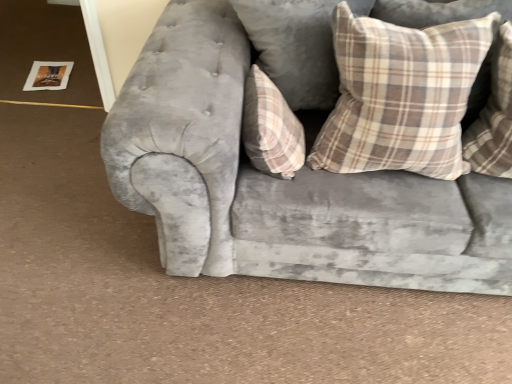
Describe the element at coordinates (271, 128) in the screenshot. The height and width of the screenshot is (384, 512). I see `plaid fabric pillow at center, the third pillow viewed from the right` at that location.

Where is `plaid fabric pillow at upper right, which ranks as the second pillow in right-to-left order`? The image size is (512, 384). plaid fabric pillow at upper right, which ranks as the second pillow in right-to-left order is located at coordinates (401, 95).

Identify the location of pillow above the plaid fabric pillow at upper right, which ranks as the second pillow in right-to-left order (from a real-world perspective). click(x=494, y=116).

From the picture: Is plaid fabric pillow at upper right, which ranks as the 1th pillow in right-to-left order, next to plaid fabric pillow at upper right, which ranks as the second pillow in right-to-left order, and touching it?

No, plaid fabric pillow at upper right, which ranks as the 1th pillow in right-to-left order, is not next to plaid fabric pillow at upper right, which ranks as the second pillow in right-to-left order.

From a real-world perspective, which is physically above, plaid fabric pillow at upper right, which ranks as the 1th pillow in right-to-left order, or plaid fabric pillow at upper right, the second pillow when ordered from left to right?

plaid fabric pillow at upper right, which ranks as the 1th pillow in right-to-left order, is physically above.

Does plaid fabric pillow at upper right, which ranks as the 1th pillow in right-to-left order, have a greater width compared to plaid fabric pillow at upper right, the second pillow when ordered from left to right?

Indeed, plaid fabric pillow at upper right, which ranks as the 1th pillow in right-to-left order, has a greater width compared to plaid fabric pillow at upper right, the second pillow when ordered from left to right.

Is plaid fabric pillow at center, which is counted as the first pillow, starting from the left, to the right of plaid fabric pillow at upper right, the second pillow when ordered from left to right, from the viewer's perspective?

No, plaid fabric pillow at center, which is counted as the first pillow, starting from the left, is not to the right of plaid fabric pillow at upper right, the second pillow when ordered from left to right.

Is plaid fabric pillow at center, which is counted as the first pillow, starting from the left, facing towards plaid fabric pillow at upper right, the second pillow when ordered from left to right?

Yes, plaid fabric pillow at center, which is counted as the first pillow, starting from the left, is turned towards plaid fabric pillow at upper right, the second pillow when ordered from left to right.

Is plaid fabric pillow at center, the third pillow viewed from the right, positioned far away from plaid fabric pillow at upper right, which ranks as the second pillow in right-to-left order?

No, plaid fabric pillow at center, the third pillow viewed from the right, is not far from plaid fabric pillow at upper right, which ranks as the second pillow in right-to-left order.

From the image's perspective, is plaid fabric pillow at center, the third pillow viewed from the right, over plaid fabric pillow at upper right, the second pillow when ordered from left to right?

No, from the image's perspective, plaid fabric pillow at center, the third pillow viewed from the right, is not above plaid fabric pillow at upper right, the second pillow when ordered from left to right.

Where is `the 1st pillow above the plaid fabric pillow at center, the third pillow viewed from the right (from the image's perspective)`? the 1st pillow above the plaid fabric pillow at center, the third pillow viewed from the right (from the image's perspective) is located at coordinates (494, 116).

Is point (275, 155) positioned after point (470, 134)?

No, it is not.

Is plaid fabric pillow at upper right, which ranks as the 1th pillow in right-to-left order, completely or partially inside plaid fabric pillow at center, the third pillow viewed from the right?

No.

Is plaid fabric pillow at center, the third pillow viewed from the right, closer to camera compared to plaid fabric pillow at upper right, which ranks as the 1th pillow in right-to-left order?

No, plaid fabric pillow at center, the third pillow viewed from the right, is behind plaid fabric pillow at upper right, which ranks as the 1th pillow in right-to-left order.

Consider the image. Is plaid fabric pillow at upper right, which ranks as the second pillow in right-to-left order, next to plaid fabric pillow at upper right, which is the 3th pillow in left-to-right order, and touching it?

plaid fabric pillow at upper right, which ranks as the second pillow in right-to-left order, and plaid fabric pillow at upper right, which is the 3th pillow in left-to-right order, are not in contact.

From a real-world perspective, is plaid fabric pillow at upper right, which ranks as the second pillow in right-to-left order, above or below plaid fabric pillow at upper right, which is the 3th pillow in left-to-right order?

plaid fabric pillow at upper right, which ranks as the second pillow in right-to-left order, is below plaid fabric pillow at upper right, which is the 3th pillow in left-to-right order.

Which is further, (371, 35) or (463, 150)?

Point (463, 150)

Considering the sizes of objects plaid fabric pillow at upper right, the second pillow when ordered from left to right, and plaid fabric pillow at center, the third pillow viewed from the right, in the image provided, who is smaller, plaid fabric pillow at upper right, the second pillow when ordered from left to right, or plaid fabric pillow at center, the third pillow viewed from the right,?

plaid fabric pillow at center, the third pillow viewed from the right.

Is plaid fabric pillow at upper right, the second pillow when ordered from left to right, positioned before plaid fabric pillow at center, the third pillow viewed from the right?

Yes, plaid fabric pillow at upper right, the second pillow when ordered from left to right, is closer to the viewer.

Between plaid fabric pillow at upper right, the second pillow when ordered from left to right, and plaid fabric pillow at center, the third pillow viewed from the right, which one has less height?

With less height is plaid fabric pillow at center, the third pillow viewed from the right.

Where is `studio couch below the plaid fabric pillow at center, the third pillow viewed from the right (from a real-world perspective)`? studio couch below the plaid fabric pillow at center, the third pillow viewed from the right (from a real-world perspective) is located at coordinates (284, 180).

Between velvet gray couch at center and plaid fabric pillow at center, the third pillow viewed from the right, which one has less height?

With less height is plaid fabric pillow at center, the third pillow viewed from the right.

Is plaid fabric pillow at center, which is counted as the first pillow, starting from the left, at the back of velvet gray couch at center?

Yes, plaid fabric pillow at center, which is counted as the first pillow, starting from the left, is at the back of velvet gray couch at center.

Is point (291, 94) closer or farther from the camera than point (437, 109)?

Point (291, 94) appears to be farther away from the viewer than point (437, 109).

Between velvet gray couch at center and plaid fabric pillow at upper right, the second pillow when ordered from left to right, which one has larger width?

With larger width is velvet gray couch at center.

Which object is positioned more to the left, velvet gray couch at center or plaid fabric pillow at upper right, which ranks as the second pillow in right-to-left order?

plaid fabric pillow at upper right, which ranks as the second pillow in right-to-left order.

This screenshot has width=512, height=384. I want to click on the 1st pillow behind the plaid fabric pillow at upper right, the second pillow when ordered from left to right, so click(494, 116).

Find the location of `the 2nd pillow in front when counting from the plaid fabric pillow at center, which is counted as the first pillow, starting from the left`. the 2nd pillow in front when counting from the plaid fabric pillow at center, which is counted as the first pillow, starting from the left is located at coordinates pos(401,95).

From the image, which object appears to be farther from plaid fabric pillow at upper right, which ranks as the second pillow in right-to-left order, plaid fabric pillow at upper right, which is the 3th pillow in left-to-right order, or velvet gray couch at center?

The object further to plaid fabric pillow at upper right, which ranks as the second pillow in right-to-left order, is plaid fabric pillow at upper right, which is the 3th pillow in left-to-right order.

From the image, which object appears to be nearer to plaid fabric pillow at upper right, the second pillow when ordered from left to right, velvet gray couch at center or plaid fabric pillow at center, which is counted as the first pillow, starting from the left?

velvet gray couch at center is positioned closer to the anchor plaid fabric pillow at upper right, the second pillow when ordered from left to right.

Based on their spatial positions, is velvet gray couch at center or plaid fabric pillow at upper right, which ranks as the 1th pillow in right-to-left order, further from plaid fabric pillow at upper right, which ranks as the second pillow in right-to-left order?

plaid fabric pillow at upper right, which ranks as the 1th pillow in right-to-left order, lies further to plaid fabric pillow at upper right, which ranks as the second pillow in right-to-left order, than the other object.

Based on their spatial positions, is plaid fabric pillow at upper right, which ranks as the second pillow in right-to-left order, or plaid fabric pillow at upper right, which is the 3th pillow in left-to-right order, further from velvet gray couch at center?

The object further to velvet gray couch at center is plaid fabric pillow at upper right, which is the 3th pillow in left-to-right order.

Which object lies nearer to the anchor point plaid fabric pillow at upper right, which ranks as the 1th pillow in right-to-left order, plaid fabric pillow at center, the third pillow viewed from the right, or velvet gray couch at center?

velvet gray couch at center lies closer to plaid fabric pillow at upper right, which ranks as the 1th pillow in right-to-left order, than the other object.

Looking at the image, which one is located closer to plaid fabric pillow at center, the third pillow viewed from the right, velvet gray couch at center or plaid fabric pillow at upper right, which ranks as the second pillow in right-to-left order?

velvet gray couch at center is positioned closer to the anchor plaid fabric pillow at center, the third pillow viewed from the right.

Estimate the real-world distances between objects in this image. Which object is further from plaid fabric pillow at center, which is counted as the first pillow, starting from the left, plaid fabric pillow at upper right, the second pillow when ordered from left to right, or plaid fabric pillow at upper right, which is the 3th pillow in left-to-right order?

Among the two, plaid fabric pillow at upper right, which is the 3th pillow in left-to-right order, is located further to plaid fabric pillow at center, which is counted as the first pillow, starting from the left.

Which object lies further to the anchor point plaid fabric pillow at upper right, which is the 3th pillow in left-to-right order, plaid fabric pillow at upper right, the second pillow when ordered from left to right, or plaid fabric pillow at center, which is counted as the first pillow, starting from the left?

plaid fabric pillow at center, which is counted as the first pillow, starting from the left.

You are a GUI agent. You are given a task and a screenshot of the screen. Output one action in this format:
    pyautogui.click(x=<x>, y=<y>)
    Task: Click on the studio couch between plaid fabric pillow at center, which is counted as the first pillow, starting from the left, and plaid fabric pillow at upper right, which ranks as the 1th pillow in right-to-left order, from left to right
    
    Given the screenshot: What is the action you would take?
    pyautogui.click(x=284, y=180)

Find the location of a particular element. The image size is (512, 384). studio couch between plaid fabric pillow at upper right, the second pillow when ordered from left to right, and plaid fabric pillow at upper right, which ranks as the 1th pillow in right-to-left order, in the horizontal direction is located at coordinates (284, 180).

I want to click on pillow between plaid fabric pillow at center, which is counted as the first pillow, starting from the left, and velvet gray couch at center, so click(x=401, y=95).

Identify the location of pillow located between plaid fabric pillow at center, the third pillow viewed from the right, and plaid fabric pillow at upper right, which is the 3th pillow in left-to-right order, in the left-right direction. (401, 95).